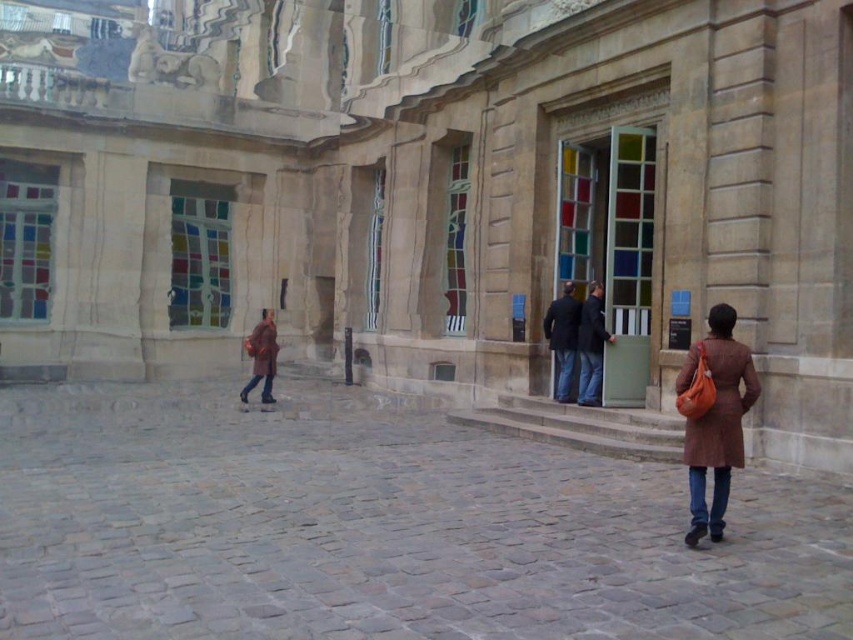
Does point (799, 499) come behind point (584, 342)?

No, (799, 499) is in front of (584, 342).

Which is more to the left, gray cobblestone pavement at center or dark brown leather jacket at center?

Positioned to the left is gray cobblestone pavement at center.

Does point (222, 467) lie behind point (583, 314)?

No.

Locate an element on the screen. This screenshot has height=640, width=853. gray cobblestone pavement at center is located at coordinates (379, 529).

Who is more forward, (519, 467) or (601, 337)?

Point (519, 467) is in front.

Between point (575, 477) and point (598, 314), which one is positioned behind?

The point (598, 314) is behind.

Locate an element on the screen. This screenshot has height=640, width=853. gray cobblestone pavement at center is located at coordinates (379, 529).

Which is in front, point (270, 365) or point (596, 330)?

Point (596, 330) is more forward.

Which is above, brown matte coat at center or brown leather coat at center?

brown leather coat at center is above.

Who is more forward, (263,339) or (596,342)?

Point (596,342) is in front.

Where is `brown matte coat at center`? The image size is (853, 640). brown matte coat at center is located at coordinates (262, 348).